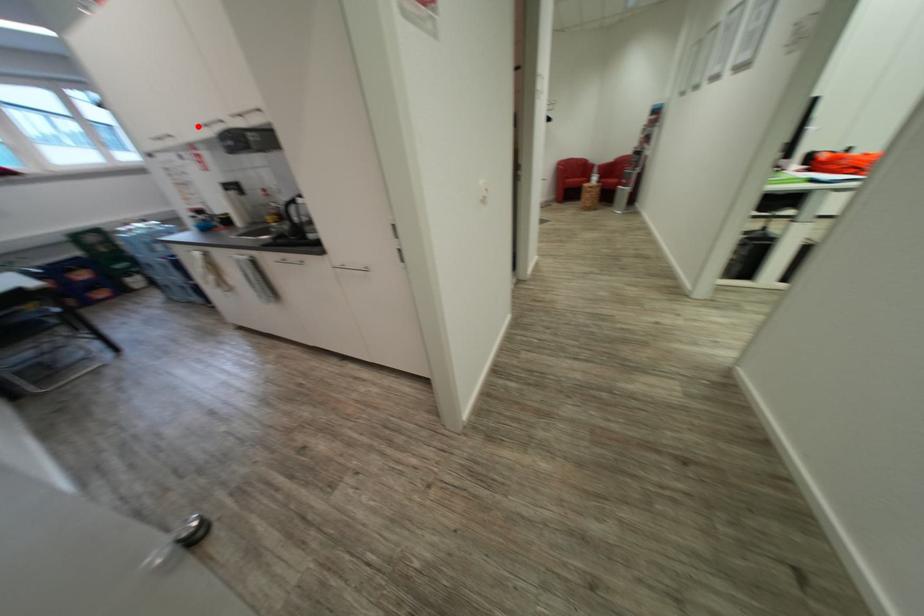
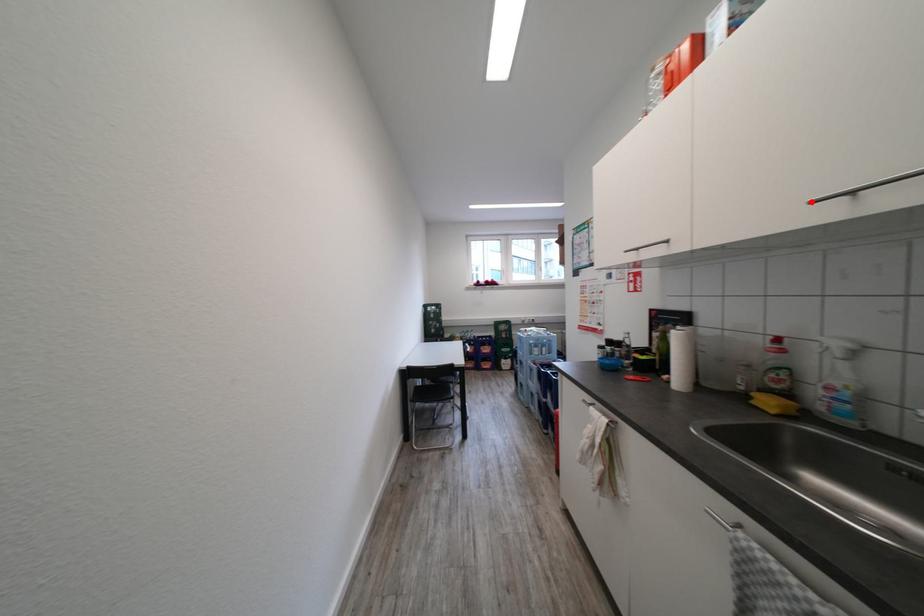
I am providing you with two images of the same scene from different viewpoints. A red point is marked on the first image and another point is marked on the second image. Does the point marked in image1 correspond to the same location as the one in image2?

Yes